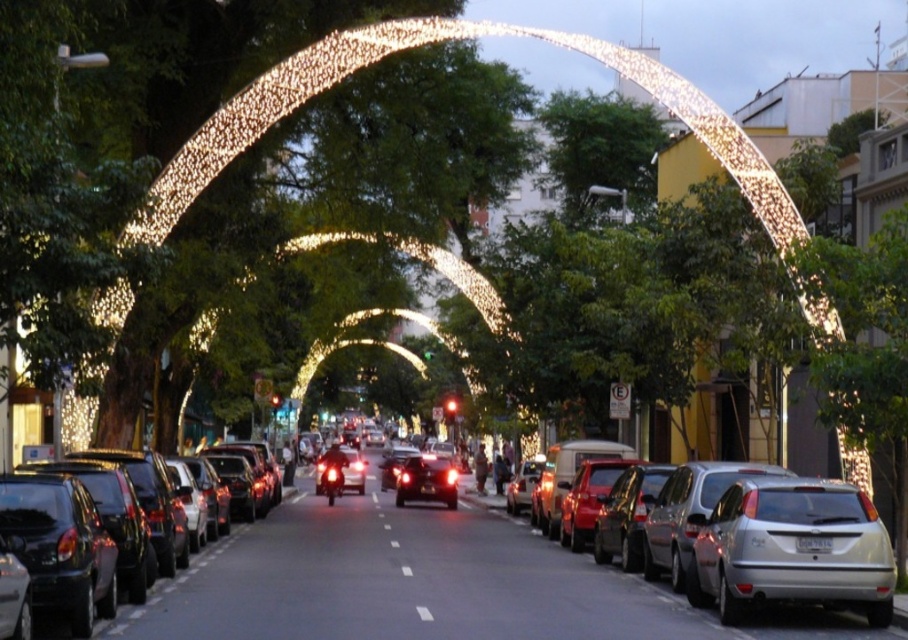
Looking at this image, you are standing at the entrance of the street and want to take a photo of the illuminated fabric arch at center. If you move 0.05 units to the right from your current position, will you be closer to the arch?

The illuminated fabric arch at center is located at point 0.070 on the x and y axis. Moving 0.05 units to the right would increase your x coordinate, so you would be moving away from the arch since the arch is at 0.070. Therefore, you would not be closer.

You are a delivery driver approaching the white dotted line at center in your vehicle. There is an illuminated fabric arch at center ahead. Can you safely stop before reaching the arch if your car requires 12 meters to stop?

The illuminated fabric arch at center is 11.79 meters from the white dotted line at center. Since the stopping distance needed is 12 meters, which is longer than the available distance of 11.79 meters, you cannot safely stop before reaching the arch.

You are a delivery driver approaching the street with an 8ft tall package. The package is too tall to pass under any obstacles. Can you drive through the space between the illuminated fabric arch at center and the white dotted line at center?

The illuminated fabric arch at center is much taller than the white dotted line at center. Since the package is 8ft tall, it can pass under the arch but may hit the white dotted line if it is lower. However, since the white dotted line is at the center and likely on the road surface, it doesn not pose a height restriction. Therefore, the package can safely pass through the space between them.